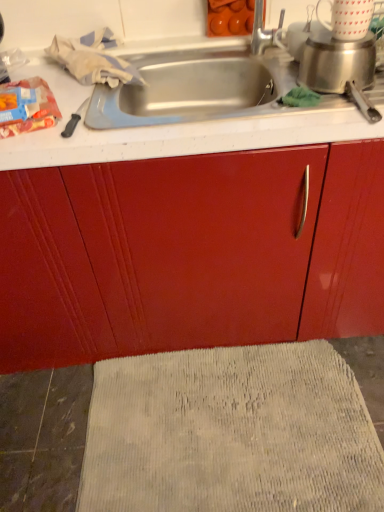
Question: Is matte plastic bag of chips at left inside the boundaries of beige textured bath mat at lower center, or outside?

Choices:
 (A) outside
 (B) inside

Answer: (A)

Question: Would you say matte plastic bag of chips at left is to the left or to the right of beige textured bath mat at lower center in the picture?

Choices:
 (A) right
 (B) left

Answer: (B)

Question: Considering the positions of point (13, 90) and point (321, 489), is point (13, 90) closer or farther from the camera than point (321, 489)?

Choices:
 (A) closer
 (B) farther

Answer: (A)

Question: Is beige textured bath mat at lower center in front of or behind matte plastic bag of chips at left in the image?

Choices:
 (A) front
 (B) behind

Answer: (B)

Question: In terms of size, does beige textured bath mat at lower center appear bigger or smaller than matte plastic bag of chips at left?

Choices:
 (A) big
 (B) small

Answer: (A)

Question: Based on their positions, is beige textured bath mat at lower center located to the left or right of matte plastic bag of chips at left?

Choices:
 (A) left
 (B) right

Answer: (B)

Question: From a real-world perspective, is beige textured bath mat at lower center physically located above or below matte plastic bag of chips at left?

Choices:
 (A) above
 (B) below

Answer: (B)